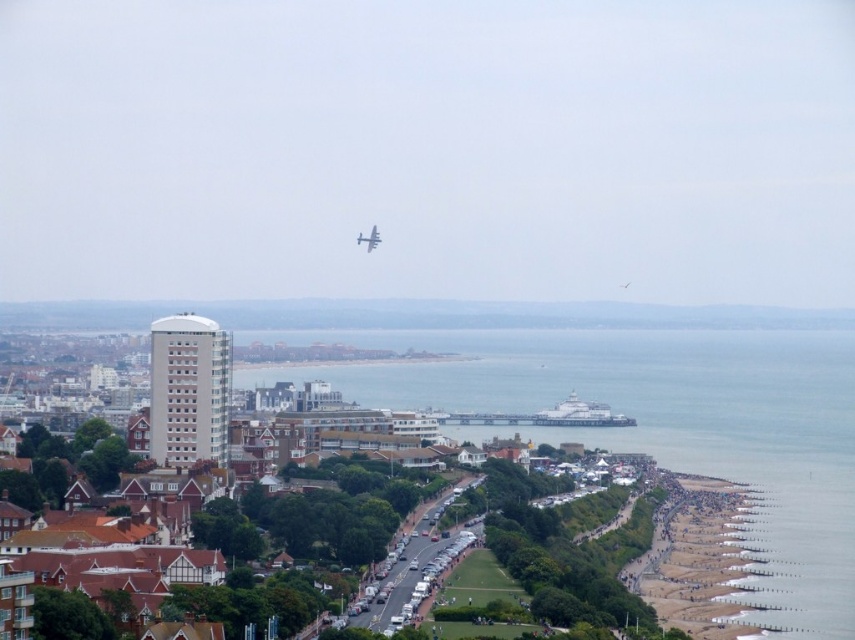
You are standing on the beach and see the clear blue water at beach right and the metallic silver airplane at center. Which object is closer to you?

The clear blue water at beach right is closer to you because the metallic silver airplane at center is behind it.

You are standing at the point marked as point (664, 428) in the image. What type of terrain are you currently standing on?

The point (664, 428) is on clear blue water at beach right, so you are standing on clear blue water.

You are a photographer planning to capture a wide shot of the coastal cityscape. You want to ensure that both the clear blue water at beach right and the metallic silver airplane at center are visible in your frame. Based on their sizes in the scene, which object will occupy more space in the photograph?

The clear blue water at beach right will occupy more space in the photograph because its width is larger than that of the metallic silver airplane at center.